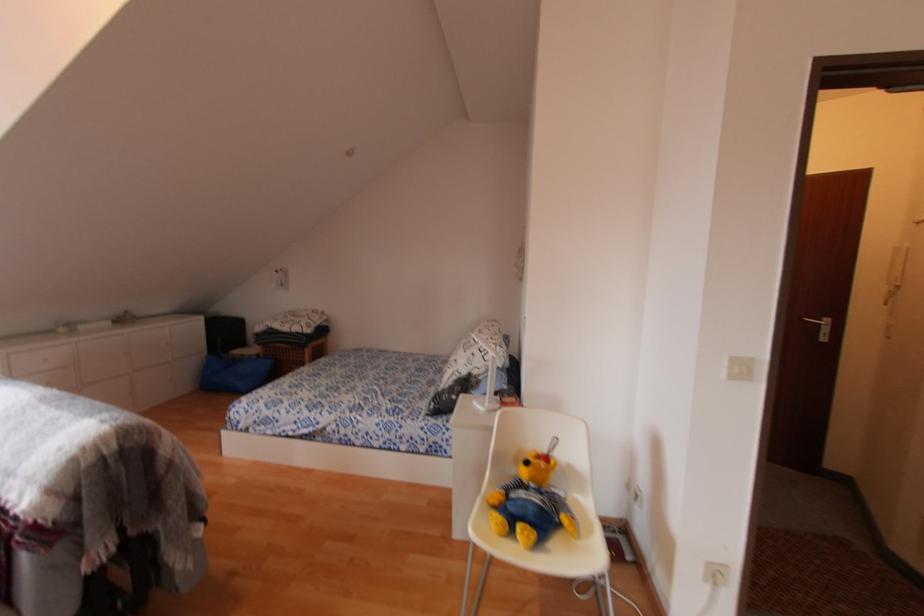
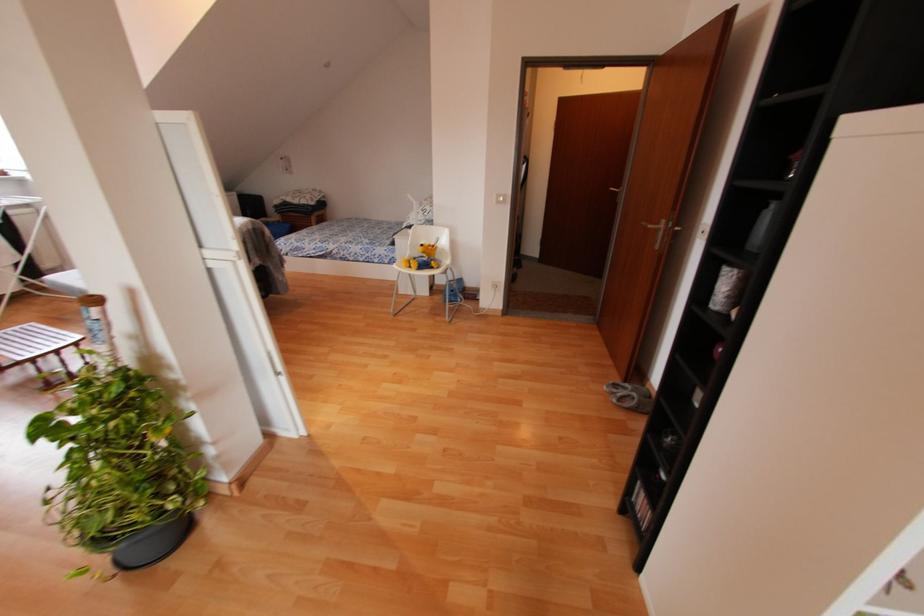
Question: In a continuous first-person perspective shot, in which direction is the camera moving?

Choices:
 (A) Left
 (B) Right
 (C) Forward
 (D) Backward

Answer: (D)